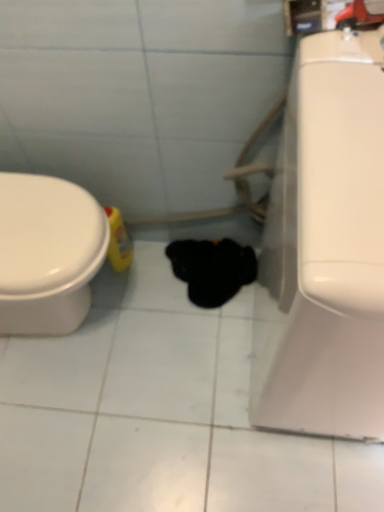
Where is `vacant space situated on the left part of black fuzzy cat at center`? vacant space situated on the left part of black fuzzy cat at center is located at coordinates (139, 294).